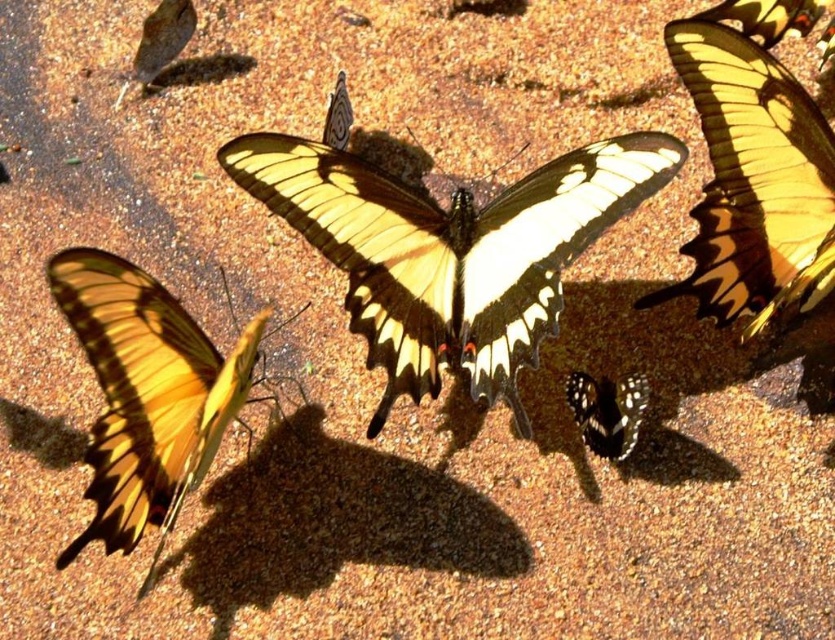
Question: Does yellow and black winged butterfly at upper right appear on the left side of yellow/golden textured wings at upper right?

Choices:
 (A) no
 (B) yes

Answer: (B)

Question: Which object is positioned farthest from the yellow and black butterfly at center?

Choices:
 (A) yellow and black winged butterfly at upper right
 (B) yellow matte butterfly at left

Answer: (B)

Question: Based on their relative distances, which object is nearer to the black glossy butterfly at lower right?

Choices:
 (A) yellow matte butterfly at left
 (B) yellow and black winged butterfly at upper right

Answer: (B)

Question: Can you confirm if yellow matte butterfly at left is smaller than black glossy butterfly at lower right?

Choices:
 (A) yes
 (B) no

Answer: (B)

Question: Is yellow and black winged butterfly at upper right further to the viewer compared to yellow/golden textured wings at upper right?

Choices:
 (A) yes
 (B) no

Answer: (B)

Question: Which point is farther to the camera?

Choices:
 (A) (170, 472)
 (B) (788, 10)
 (C) (792, 120)
 (D) (590, 435)

Answer: (B)